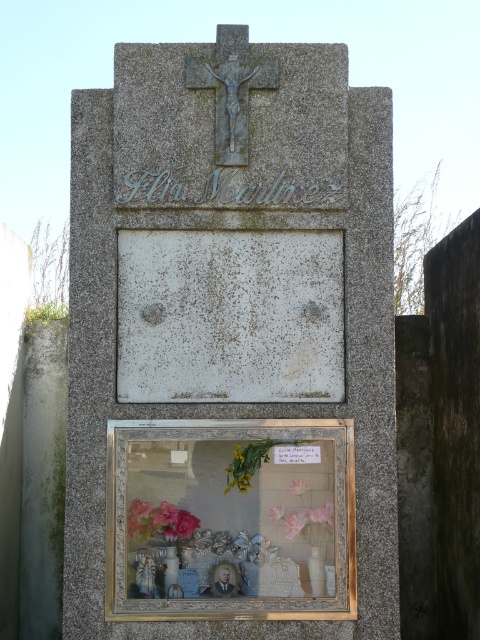
Between granite cross at upper center and pink matte flower at lower center, which one is positioned lower?

pink matte flower at lower center

Does granite cross at upper center appear over pink matte flower at lower center?

Correct, granite cross at upper center is located above pink matte flower at lower center.

The image size is (480, 640). What do you see at coordinates (231, 344) in the screenshot?
I see `granite cross at upper center` at bounding box center [231, 344].

Locate an element on the screen. granite cross at upper center is located at coordinates (231, 344).

Does pink matte flowers at lower left have a lesser height compared to pink matte flower at lower center?

No, pink matte flowers at lower left is not shorter than pink matte flower at lower center.

Between pink matte flowers at lower left and pink matte flower at lower center, which one has more height?

pink matte flowers at lower left is taller.

Does point (146, 522) lie in front of point (268, 516)?

Yes.

Find the location of a particular element. The height and width of the screenshot is (640, 480). pink matte flowers at lower left is located at coordinates (159, 520).

Which of these two, pink fabric flower at center or pink matte flower at center, stands shorter?

With less height is pink matte flower at center.

Does pink fabric flower at center appear under pink matte flower at center?

Yes.

What are the coordinates of `pink fabric flower at center` in the screenshot? It's located at 295,522.

At what (x,y) coordinates should I click in order to perform the action: click on pink fabric flower at center. Please return your answer as a coordinate pair (x, y). This screenshot has height=640, width=480. Looking at the image, I should click on (295, 522).